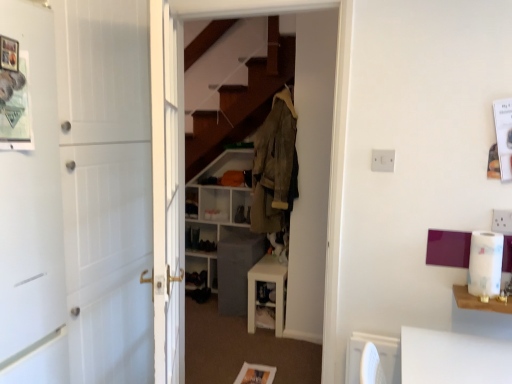
Question: Is wooden dresser at center at the back of white plastic shelf at center, placed as the second shelf when sorted from bottom to top?

Choices:
 (A) no
 (B) yes

Answer: (A)

Question: Does white plastic shelf at center, which is the 1th shelf in top-to-bottom order, have a greater width compared to wooden dresser at center?

Choices:
 (A) yes
 (B) no

Answer: (A)

Question: Is white plastic shelf at center, which is the 1th shelf in top-to-bottom order, closer to camera compared to wooden dresser at center?

Choices:
 (A) no
 (B) yes

Answer: (A)

Question: Is white plastic shelf at center, placed as the second shelf when sorted from bottom to top, not within wooden dresser at center?

Choices:
 (A) yes
 (B) no

Answer: (A)

Question: Is white plastic shelf at center, placed as the second shelf when sorted from bottom to top, bigger than wooden dresser at center?

Choices:
 (A) yes
 (B) no

Answer: (B)

Question: Considering their positions, is dark gray fabric shoe at center located in front of or behind white wood door at left?

Choices:
 (A) front
 (B) behind

Answer: (B)

Question: Does point (240, 208) appear closer or farther from the camera than point (138, 317)?

Choices:
 (A) closer
 (B) farther

Answer: (B)

Question: In the image, is dark gray fabric shoe at center on the left side or the right side of white wood door at left?

Choices:
 (A) left
 (B) right

Answer: (B)

Question: From a real-world perspective, is dark gray fabric shoe at center above or below white wood door at left?

Choices:
 (A) above
 (B) below

Answer: (B)

Question: From the image's perspective, is white plastic shelf at center, placed as the second shelf when sorted from bottom to top, located above or below camouflage fabric jacket at center?

Choices:
 (A) above
 (B) below

Answer: (B)

Question: Relative to camouflage fabric jacket at center, is white plastic shelf at center, which is the 1th shelf in top-to-bottom order, in front or behind?

Choices:
 (A) behind
 (B) front

Answer: (A)

Question: Is point (190, 206) positioned closer to the camera than point (257, 160)?

Choices:
 (A) closer
 (B) farther

Answer: (B)

Question: In terms of width, does white plastic shelf at center, placed as the second shelf when sorted from bottom to top, look wider or thinner when compared to camouflage fabric jacket at center?

Choices:
 (A) wide
 (B) thin

Answer: (B)

Question: In terms of width, does wooden dresser at center look wider or thinner when compared to white plastic table at right?

Choices:
 (A) wide
 (B) thin

Answer: (B)

Question: Considering the relative positions of wooden dresser at center and white plastic table at right in the image provided, is wooden dresser at center to the left or to the right of white plastic table at right?

Choices:
 (A) left
 (B) right

Answer: (A)